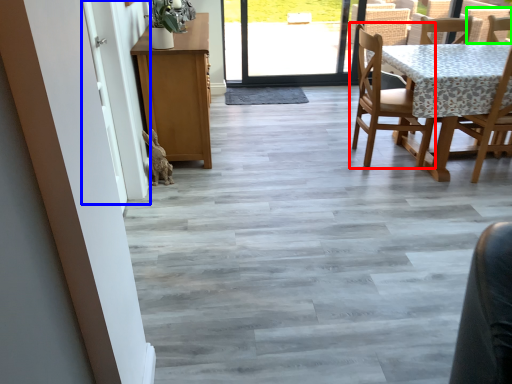
Question: Estimate the real-world distances between objects in this image. Which object is closer to chair (highlighted by a red box), screen door (highlighted by a blue box) or armchair (highlighted by a green box)?

Choices:
 (A) screen door
 (B) armchair

Answer: (B)